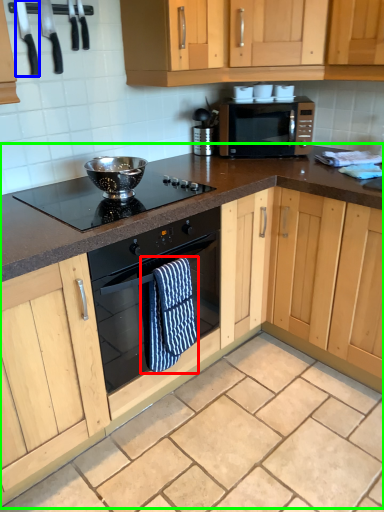
Question: Based on their relative distances, which object is nearer to bath towel (highlighted by a red box)? Choose from appliance (highlighted by a blue box) and cabinetry (highlighted by a green box).

Choices:
 (A) appliance
 (B) cabinetry

Answer: (B)